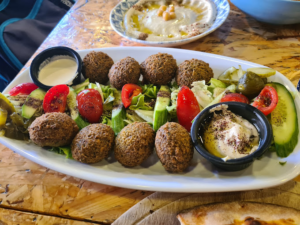
Identify the location of plywood. (23, 184).